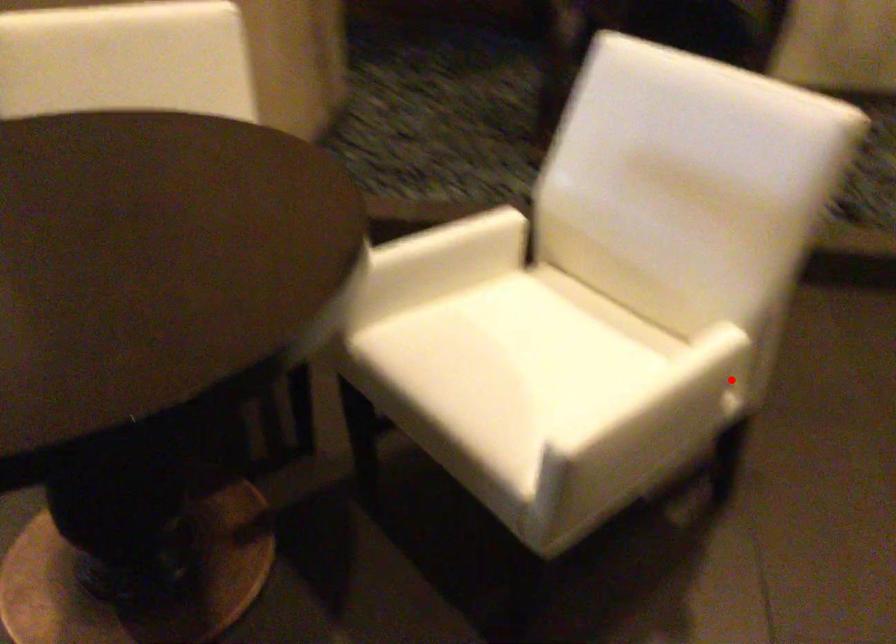
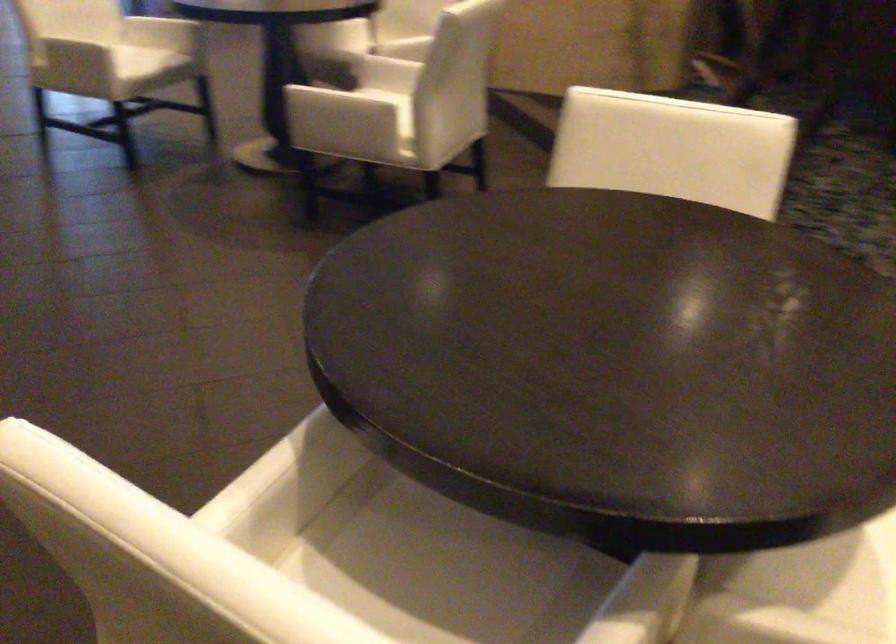
Question: A red point is marked in image1. In image2, is the corresponding 3D point closer to the camera or farther? Reply with the corresponding letter.

Choices:
 (A) The corresponding 3D point is closer.
 (B) The corresponding 3D point is farther.

Answer: (B)